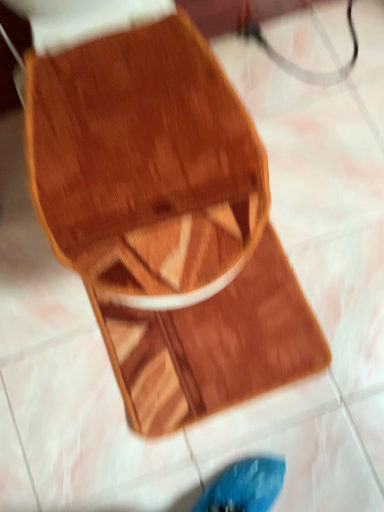
The height and width of the screenshot is (512, 384). I want to click on vacant space to the right of wooden cutting board at center, so click(x=339, y=263).